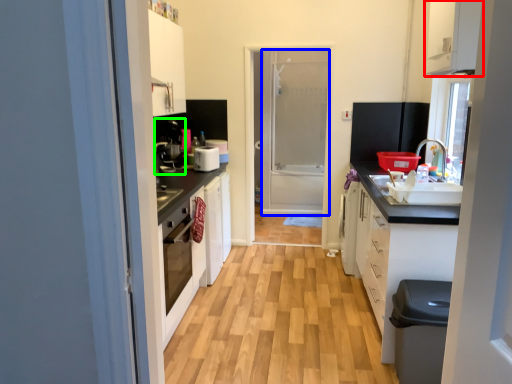
Question: Which object is positioned farthest from cabinetry (highlighted by a red box)? Select from screen door (highlighted by a blue box) and coffee machine (highlighted by a green box).

Choices:
 (A) screen door
 (B) coffee machine

Answer: (A)